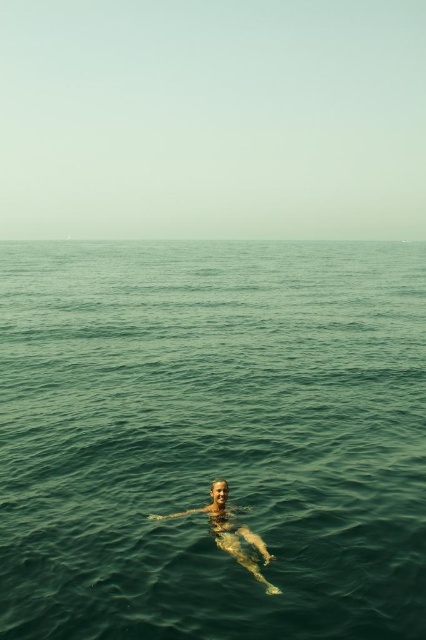
Question: Does green water at center appear on the right side of smooth skin person at center?

Choices:
 (A) yes
 (B) no

Answer: (A)

Question: Does green water at center appear on the right side of smooth skin person at center?

Choices:
 (A) yes
 (B) no

Answer: (A)

Question: Is green water at center closer to the viewer compared to smooth skin person at center?

Choices:
 (A) yes
 (B) no

Answer: (A)

Question: Which point is closer to the camera?

Choices:
 (A) green water at center
 (B) smooth skin person at center

Answer: (A)